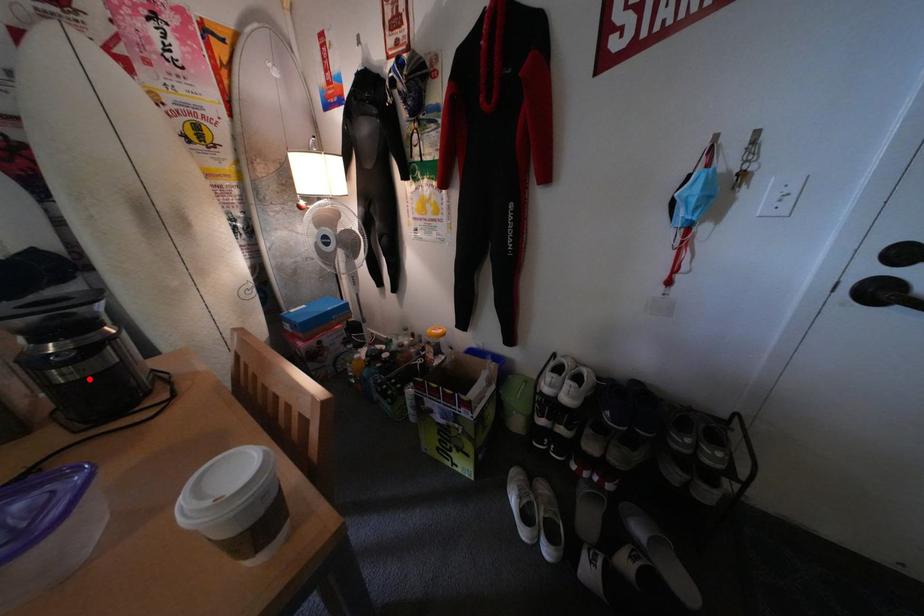
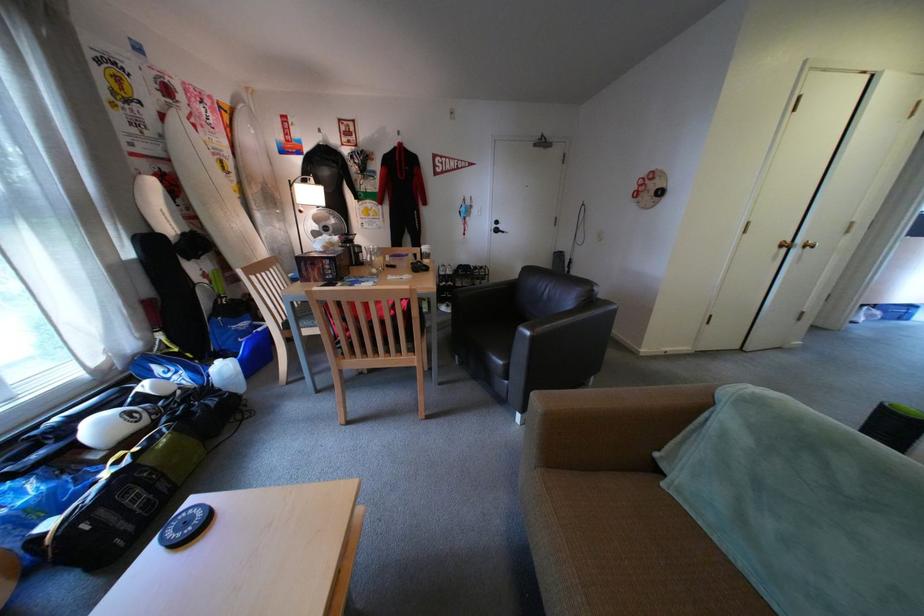
Where in the second image is the point corresponding to the highlighted location from the first image?

(373, 253)